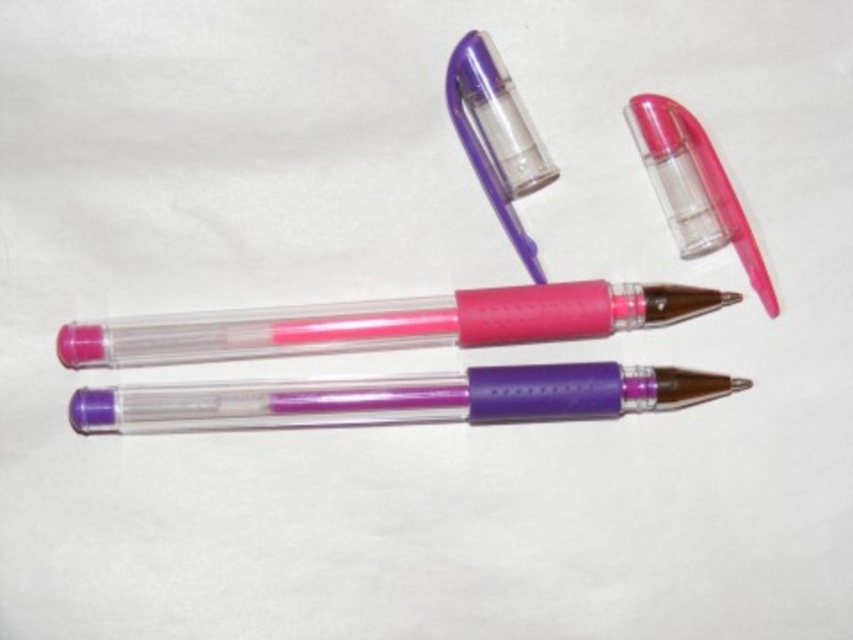
You are organizing a stationery drawer and need to place the pink translucent pen at center and the purple translucent pen at center into slots that are only 10 cm tall. The pink pen is 12 cm long and the purple pen is 10 cm long. Can both pens fit vertically in their respective slots without bending them?

The pink translucent pen at center is 12 cm long, which exceeds the 10 cm slot height, so it cannot fit vertically. The purple translucent pen at center is exactly 10 cm long and can fit perfectly in its slot.

You are a delivery drone carrying a package that needs to be placed between the pink translucent pen at center and the pink translucent lipstick at upper right. The package is 10 inches long. Will the space between them accommodate the package?

The distance between the pink translucent pen at center and the pink translucent lipstick at upper right is 9.45 inches. Since the package is 10 inches long, it will not fit in the available space.

You are organizing a makeup kit and need to place the purple translucent pen at center and the pink translucent lipstick at upper right. Based on their positions in the image, which object is closer to you?

The purple translucent pen at center is closer to you because it is in front of the pink translucent lipstick at upper right.